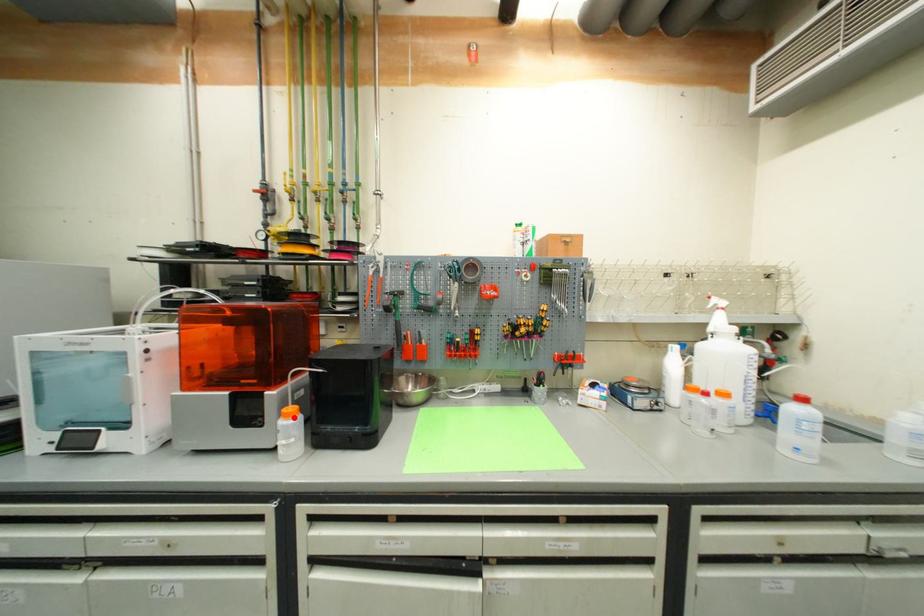
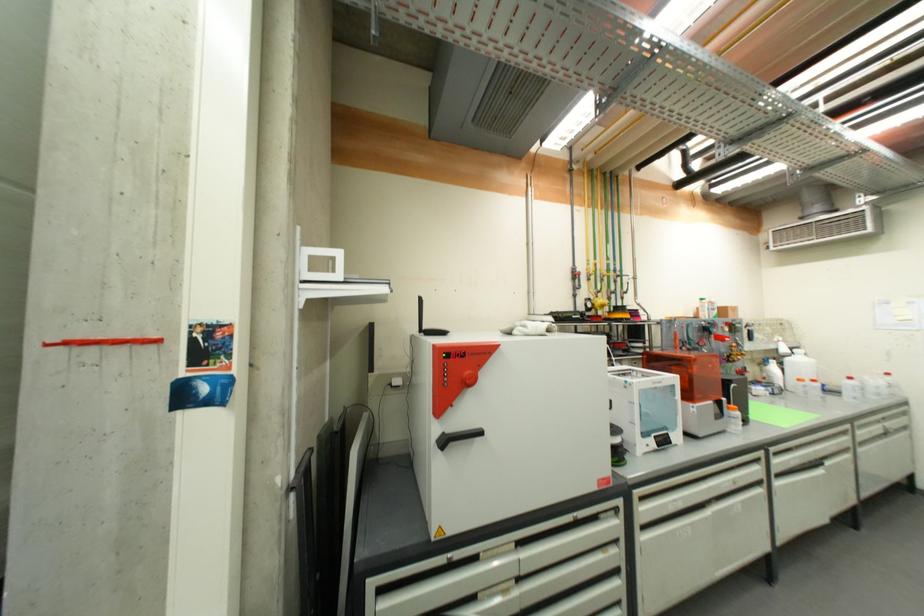
Find the pixel in the second image that matches the highlighted location in the first image.

(739, 411)